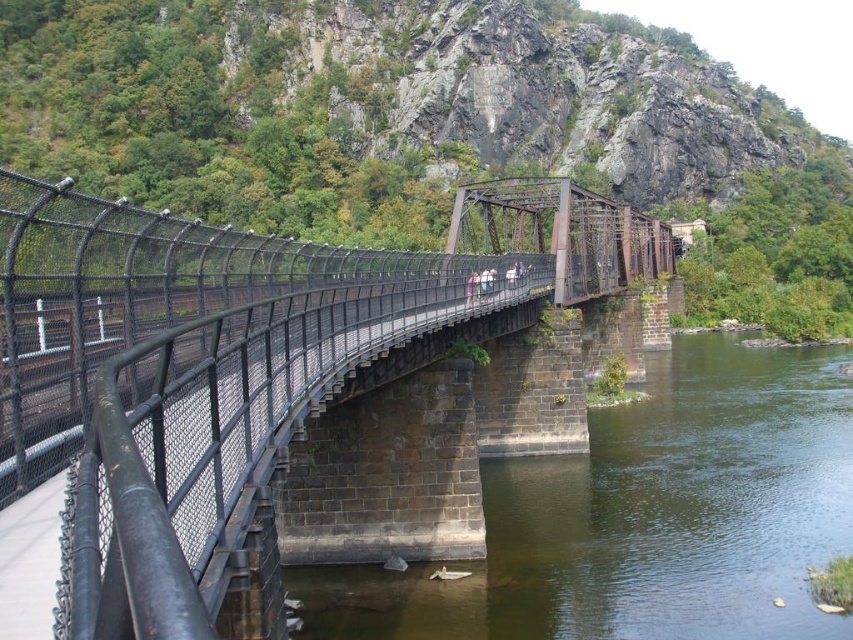
Question: Does black metal fence at center have a lesser width compared to greenish-brown stone river at center?

Choices:
 (A) no
 (B) yes

Answer: (A)

Question: Is black metal fence at center bigger than greenish-brown stone river at center?

Choices:
 (A) no
 (B) yes

Answer: (B)

Question: Does black metal fence at center appear on the left side of greenish-brown stone river at center?

Choices:
 (A) yes
 (B) no

Answer: (A)

Question: Which object is farther from the camera taking this photo?

Choices:
 (A) black metal fence at center
 (B) greenish-brown stone river at center

Answer: (B)

Question: Which object is closer to the camera taking this photo?

Choices:
 (A) greenish-brown stone river at center
 (B) black metal fence at center

Answer: (B)

Question: Which point is closer to the camera?

Choices:
 (A) (831, 358)
 (B) (184, 561)

Answer: (B)